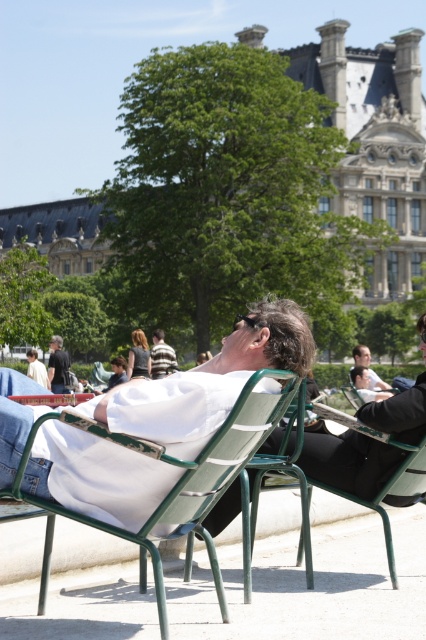
Question: Which object is the farthest from the blonde hair at center?

Choices:
 (A) light beige shirt at center
 (B) dark gray shirt at center
 (C) smooth skin man at center

Answer: (C)

Question: Among these points, which one is farthest from the camera?

Choices:
 (A) (393, 412)
 (B) (152, 349)

Answer: (B)

Question: Which point is closer to the camera?

Choices:
 (A) (48, 548)
 (B) (357, 364)
 (C) (121, 365)
 (D) (36, 358)

Answer: (A)

Question: Can you confirm if matte black jacket at center is positioned above white cotton shirt at center?

Choices:
 (A) yes
 (B) no

Answer: (B)

Question: Can you confirm if dark brown leather jacket at center is positioned above dark gray shirt at center?

Choices:
 (A) no
 (B) yes

Answer: (A)

Question: Is the position of smooth skin man at center more distant than that of light beige shirt at center?

Choices:
 (A) yes
 (B) no

Answer: (B)